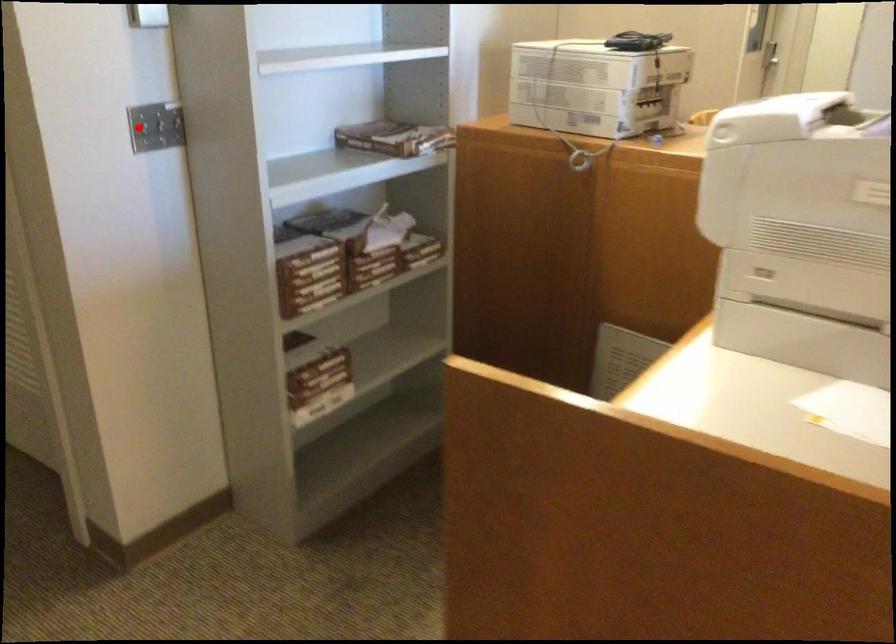
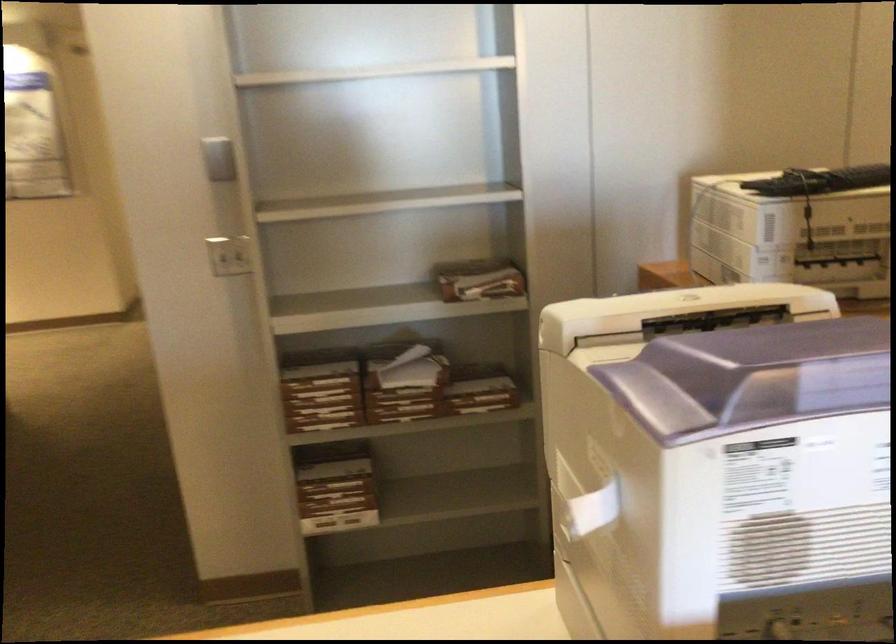
Question: I am providing you with two images of the same scene from different viewpoints. In image1, a red point is highlighted. Considering the same 3D point in image2, which of the following is correct?

Choices:
 (A) It is closer
 (B) It is farther

Answer: (B)